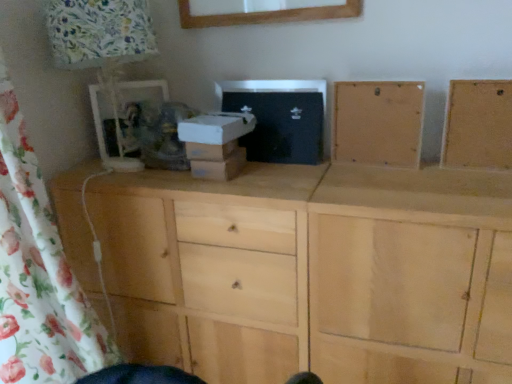
Image resolution: width=512 pixels, height=384 pixels. Find the location of `vacant space that is in between natural wood frame at upper right, which is the 1th cabinetry from right to left, and white cardboard box at center`. vacant space that is in between natural wood frame at upper right, which is the 1th cabinetry from right to left, and white cardboard box at center is located at coordinates (339, 170).